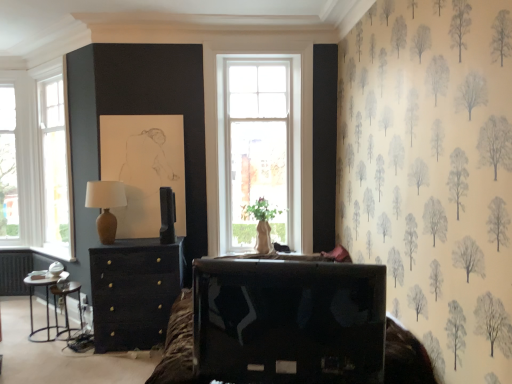
Question: Visually, is matte brown table lamp at left positioned to the left or to the right of matte black chest of drawers at center?

Choices:
 (A) right
 (B) left

Answer: (B)

Question: From the image's perspective, relative to matte black chest of drawers at center, is matte brown table lamp at left above or below?

Choices:
 (A) below
 (B) above

Answer: (B)

Question: Estimate the real-world distances between objects in this image. Which object is farther from the metallic black side table at lower left?

Choices:
 (A) matte brown table lamp at left
 (B) metallic silver side table at lower left
 (C) shiny black tv at lower center
 (D) matte black chest of drawers at center
 (E) white glass window at left

Answer: (C)

Question: Based on their relative distances, which object is nearer to the shiny black tv at lower center?

Choices:
 (A) metallic silver side table at lower left
 (B) metallic black side table at lower left
 (C) white glass window at left
 (D) matte brown table lamp at left
 (E) matte black chest of drawers at center

Answer: (E)